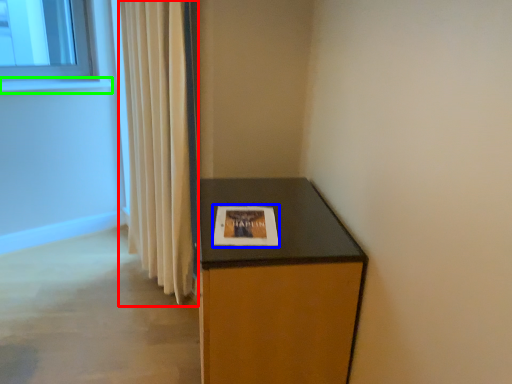
Question: Which is farther away from curtain (highlighted by a red box)? picture frame (highlighted by a blue box) or window sill (highlighted by a green box)?

Choices:
 (A) picture frame
 (B) window sill

Answer: (B)